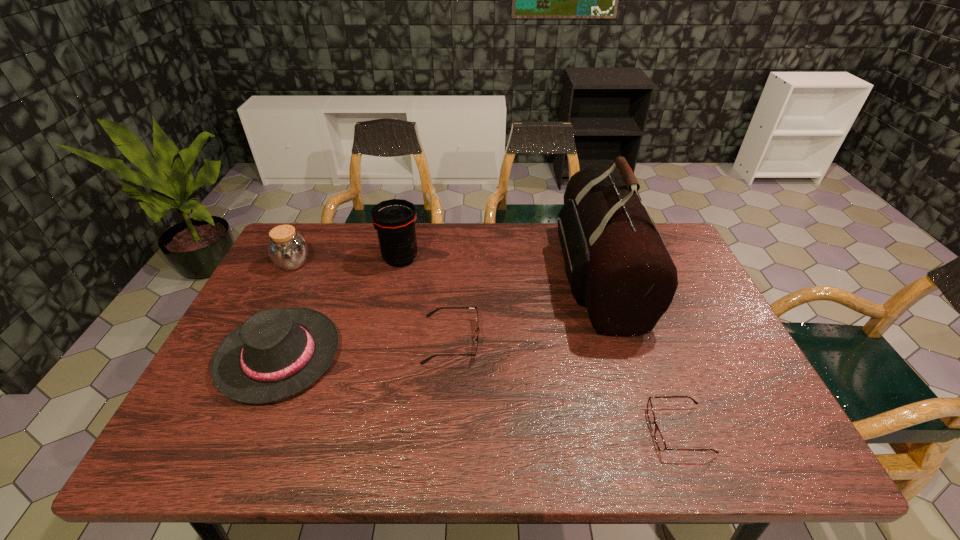
At what (x,y) coordinates should I click in order to perform the action: click on free space located 0.280m on the front pocket of the duffel bag. Please return your answer as a coordinate pair (x, y). Looking at the image, I should click on (466, 276).

Where is `vacant point located 0.220m on the front pocket of the duffel bag`? This screenshot has width=960, height=540. vacant point located 0.220m on the front pocket of the duffel bag is located at coordinates coord(486,276).

Where is `free location located on the right of the fourth object from right to left`? free location located on the right of the fourth object from right to left is located at coordinates (493, 259).

Find the location of a particular element. This screenshot has width=960, height=540. vacant region located on the right of the jar is located at coordinates (359, 264).

Identify the location of vacant space located on the back of the dress hat. coord(330,239).

You are a GUI agent. You are given a task and a screenshot of the screen. Output one action in this format:
    pyautogui.click(x=<x>, y=<y>)
    Task: Click on the vacant region located 0.390m on the front-facing side of the second shortest object
    
    Given the screenshot: What is the action you would take?
    pyautogui.click(x=630, y=340)

Locate an element on the screen. vacant point located on the lenses of the right spectacles is located at coordinates (619, 430).

Identify the location of vacant region located on the lenses of the right spectacles. This screenshot has height=540, width=960. (517, 430).

I want to click on vacant space located 0.190m on the lenses of the right spectacles, so click(564, 430).

Find the location of a particular element. duffel bag present at the far edge is located at coordinates (616, 263).